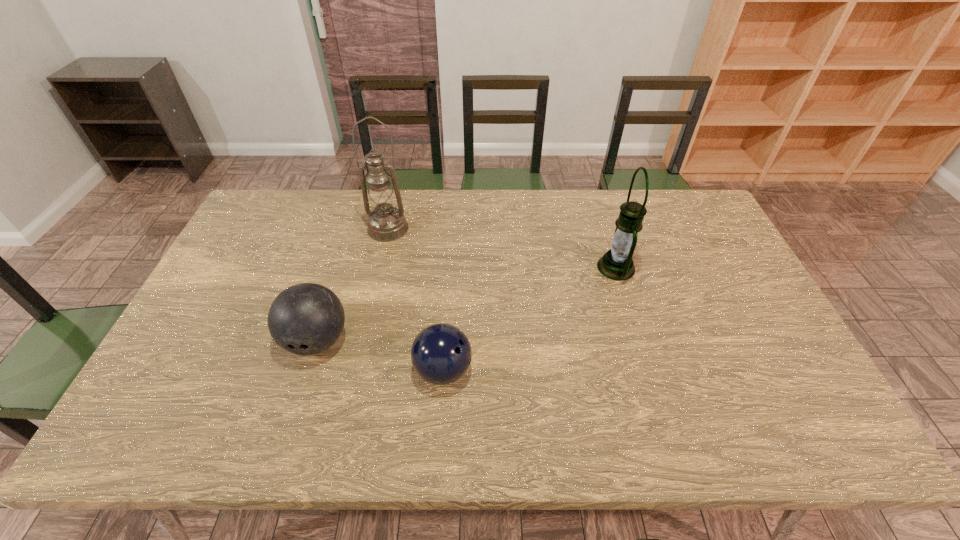
I want to click on vacant area between the second farthest object and the shorter bowling ball, so click(530, 319).

Find the location of a particular element. The width and height of the screenshot is (960, 540). free space between the second shortest object and the oil lamp is located at coordinates (352, 285).

This screenshot has height=540, width=960. What are the coordinates of `unoccupied area between the oil lamp and the taller bowling ball` in the screenshot? It's located at (352, 285).

Identify the location of vacant area between the shorter bowling ball and the taller bowling ball. (380, 355).

Image resolution: width=960 pixels, height=540 pixels. I want to click on vacant point located between the shorter bowling ball and the taller bowling ball, so click(380, 355).

The width and height of the screenshot is (960, 540). I want to click on free area in between the farthest object and the third object from left to right, so click(416, 299).

Find the location of a particular element. This screenshot has width=960, height=540. free space between the taller bowling ball and the farthest object is located at coordinates (352, 285).

The image size is (960, 540). In order to click on unoccupied area between the shorter bowling ball and the left bowling ball in this screenshot , I will do `click(380, 355)`.

Locate an element on the screen. The height and width of the screenshot is (540, 960). free space between the right bowling ball and the oil lamp is located at coordinates (416, 299).

Point out which object is positioned as the nearest to the third nearest object. Please provide its 2D coordinates. Your answer should be formatted as a tuple, i.e. [(x, y)], where the tuple contains the x and y coordinates of a point satisfying the conditions above.

[(441, 353)]